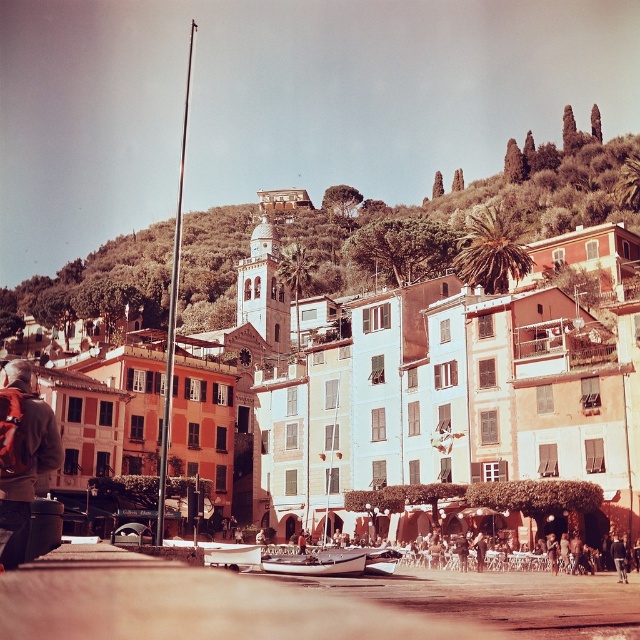
Question: Is red backpack at lower left smaller than metallic silver boat at lower center?

Choices:
 (A) yes
 (B) no

Answer: (B)

Question: Which object appears closest to the camera in this image?

Choices:
 (A) matte stone buildings at center
 (B) green leafy hillside at upper center

Answer: (A)

Question: Is matte stone buildings at center above green leafy hillside at upper center?

Choices:
 (A) no
 (B) yes

Answer: (A)

Question: Estimate the real-world distances between objects in this image. Which object is farther from the green leafy hillside at upper center?

Choices:
 (A) red backpack at lower left
 (B) metallic silver boat at lower center

Answer: (A)

Question: Which point appears farthest from the camera in this image?

Choices:
 (A) (60, 458)
 (B) (253, 516)
 (C) (634, 218)

Answer: (C)

Question: Observing the image, what is the correct spatial positioning of matte stone buildings at center in reference to green leafy hillside at upper center?

Choices:
 (A) below
 (B) above

Answer: (A)